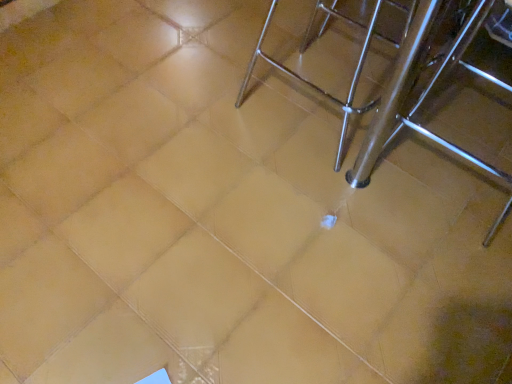
This screenshot has height=384, width=512. I want to click on vacant space behind polished metal chair at upper right, so [x=309, y=23].